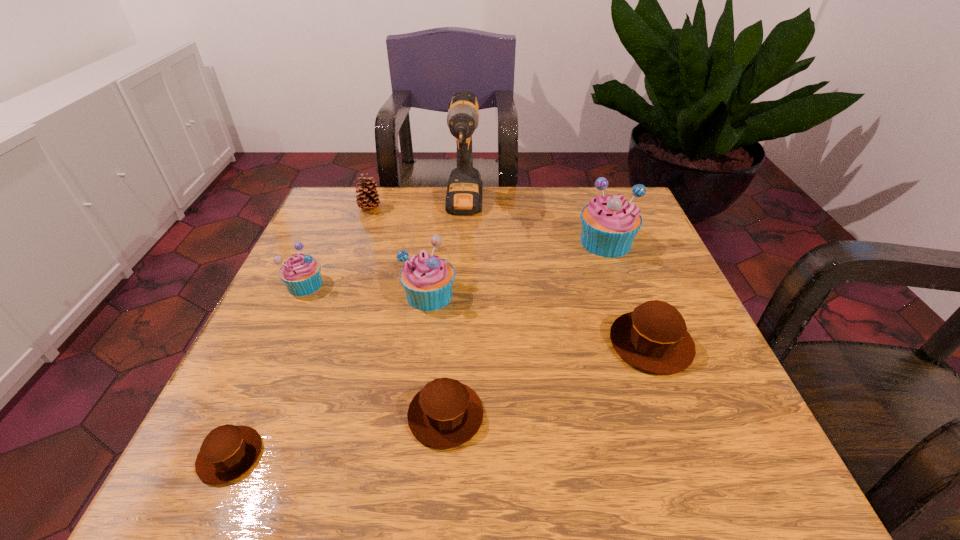
Locate an element on the screen. vacant area at the left edge is located at coordinates (338, 239).

In the image, there is a desktop. At what (x,y) coordinates should I click in order to perform the action: click on vacant space at the right edge. Please return your answer as a coordinate pair (x, y). Looking at the image, I should click on (598, 261).

You are a GUI agent. You are given a task and a screenshot of the screen. Output one action in this format:
    pyautogui.click(x=<x>, y=<y>)
    Task: Click on the free space at the far left corner
    The width and height of the screenshot is (960, 540).
    Given the screenshot: What is the action you would take?
    pyautogui.click(x=371, y=235)

Identify the location of free location at the far right corner. The width and height of the screenshot is (960, 540). (637, 200).

Find the location of a particular element. Image resolution: width=960 pixels, height=540 pixels. vacant space at the near right corner of the desktop is located at coordinates (715, 456).

At what (x,y) coordinates should I click in order to perform the action: click on free space between the drill and the pinecone. Please return your answer as a coordinate pair (x, y). This screenshot has width=960, height=540. Looking at the image, I should click on (417, 208).

Locate an element on the screen. vacant space in between the third object from left to right and the shortest object is located at coordinates (300, 332).

This screenshot has width=960, height=540. Identify the location of vacant space that is in between the tallest muffin and the second smallest blue muffin. (517, 268).

Find the location of a particular element. vacant space that's between the drill and the second shortest muffin is located at coordinates (455, 312).

Identify the location of vacant region between the second biggest brown muffin and the smallest blue muffin. (375, 350).